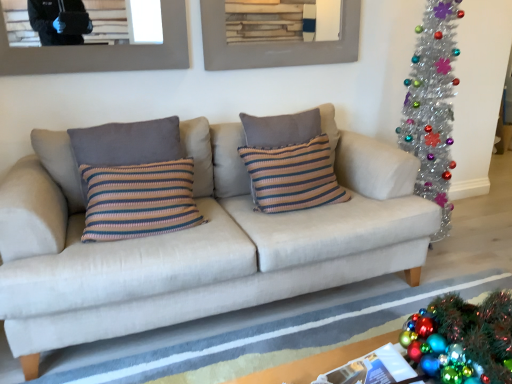
Image resolution: width=512 pixels, height=384 pixels. Describe the element at coordinates (276, 43) in the screenshot. I see `wooden frame at upper center, marked as the first picture frame in a right-to-left arrangement` at that location.

Identify the location of striped knit pillow at center, acting as the 2th pillow starting from the left. (292, 176).

This screenshot has height=384, width=512. I want to click on white fabric rug at lower center, so coord(257,330).

What do you see at coordinates (196, 241) in the screenshot? This screenshot has height=384, width=512. I see `beige fabric couch at center` at bounding box center [196, 241].

Locate an element on the screen. shiny metallic wreath at lower right is located at coordinates (462, 339).

Is white fabric rug at lower center with shiny metallic wreath at lower right?

white fabric rug at lower center and shiny metallic wreath at lower right are not in contact.

Is white fabric rug at lower center positioned beyond the bounds of shiny metallic wreath at lower right?

Indeed, white fabric rug at lower center is completely outside shiny metallic wreath at lower right.

What's the angular difference between white fabric rug at lower center and shiny metallic wreath at lower right's facing directions?

93 degrees.

There is a white fabric rug at lower center. Find the location of `christmas decoration above it (from a real-world perspective)`. christmas decoration above it (from a real-world perspective) is located at coordinates (462, 339).

Is point (314, 60) less distant than point (127, 146)?

No.

In terms of width, does wooden frame at upper center, marked as the first picture frame in a right-to-left arrangement, look wider or thinner when compared to striped fabric pillow at left, the 2th pillow positioned from the right?

Clearly, wooden frame at upper center, marked as the first picture frame in a right-to-left arrangement, has less width compared to striped fabric pillow at left, the 2th pillow positioned from the right.

Which object is closer to the camera taking this photo, wooden frame at upper center, marked as the first picture frame in a right-to-left arrangement, or striped fabric pillow at left, the 2th pillow positioned from the right?

striped fabric pillow at left, the 2th pillow positioned from the right, is more forward.

Is wooden frame at upper center, the second picture frame from the left, at the left side of striped fabric pillow at left, marked as the 1th pillow in a left-to-right arrangement?

Incorrect, wooden frame at upper center, the second picture frame from the left, is not on the left side of striped fabric pillow at left, marked as the 1th pillow in a left-to-right arrangement.

From the image's perspective, is shiny metallic wreath at lower right on striped knit pillow at center, acting as the first pillow starting from the right?

No.

Which object is more forward, shiny metallic wreath at lower right or striped knit pillow at center, acting as the first pillow starting from the right?

shiny metallic wreath at lower right.

In the image, is shiny metallic wreath at lower right on the left side or the right side of striped knit pillow at center, acting as the first pillow starting from the right?

Based on their positions, shiny metallic wreath at lower right is located to the right of striped knit pillow at center, acting as the first pillow starting from the right.

Between striped fabric pillow at left, marked as the 1th pillow in a left-to-right arrangement, and brushed metal picture frame at upper center, the first picture frame from the left, which one appears on the left side from the viewer's perspective?

From the viewer's perspective, brushed metal picture frame at upper center, the first picture frame from the left, appears more on the left side.

From a real-world perspective, is striped fabric pillow at left, marked as the 1th pillow in a left-to-right arrangement, positioned above or below brushed metal picture frame at upper center, the first picture frame from the left?

striped fabric pillow at left, marked as the 1th pillow in a left-to-right arrangement, is below brushed metal picture frame at upper center, the first picture frame from the left.

Looking at this image, is there a large distance between striped fabric pillow at left, marked as the 1th pillow in a left-to-right arrangement, and brushed metal picture frame at upper center, the second picture frame from the right?

striped fabric pillow at left, marked as the 1th pillow in a left-to-right arrangement, is near brushed metal picture frame at upper center, the second picture frame from the right, not far away.

From the image's perspective, is striped fabric pillow at left, marked as the 1th pillow in a left-to-right arrangement, above or below brushed metal picture frame at upper center, the second picture frame from the right?

Based on their image positions, striped fabric pillow at left, marked as the 1th pillow in a left-to-right arrangement, is located beneath brushed metal picture frame at upper center, the second picture frame from the right.

What are the coordinates of `the 2nd pillow to the right when counting from the brushed metal picture frame at upper center, the first picture frame from the left` in the screenshot? It's located at (292, 176).

Between point (293, 149) and point (42, 59), which one is positioned behind?

Point (293, 149)

Is the position of white fabric rug at lower center more distant than that of brushed metal picture frame at upper center, the second picture frame from the right?

No.

Considering the sizes of objects white fabric rug at lower center and brushed metal picture frame at upper center, the first picture frame from the left, in the image provided, who is wider, white fabric rug at lower center or brushed metal picture frame at upper center, the first picture frame from the left,?

Wider between the two is white fabric rug at lower center.

Considering the points (121, 381) and (9, 74), which point is behind, point (121, 381) or point (9, 74)?

The point (9, 74) is behind.

From a real-world perspective, which object rests below the other?

white fabric rug at lower center is physically lower.

Could you tell me if shiny metallic wreath at lower right is facing wooden frame at upper center, marked as the first picture frame in a right-to-left arrangement?

No, shiny metallic wreath at lower right is not oriented towards wooden frame at upper center, marked as the first picture frame in a right-to-left arrangement.

Considering the relative sizes of shiny metallic wreath at lower right and wooden frame at upper center, marked as the first picture frame in a right-to-left arrangement, in the image provided, is shiny metallic wreath at lower right wider than wooden frame at upper center, marked as the first picture frame in a right-to-left arrangement,?

Yes.

How much distance is there between shiny metallic wreath at lower right and wooden frame at upper center, the second picture frame from the left?

shiny metallic wreath at lower right is 1.69 meters from wooden frame at upper center, the second picture frame from the left.

Considering the relative sizes of shiny metallic wreath at lower right and wooden frame at upper center, marked as the first picture frame in a right-to-left arrangement, in the image provided, is shiny metallic wreath at lower right smaller than wooden frame at upper center, marked as the first picture frame in a right-to-left arrangement,?

Incorrect, shiny metallic wreath at lower right is not smaller in size than wooden frame at upper center, marked as the first picture frame in a right-to-left arrangement.

The image size is (512, 384). What are the coordinates of `strip below the shiny metallic wreath at lower right (from the image's perspective)` in the screenshot? It's located at (257, 330).

Where is `the 2nd picture frame located above the striped fabric pillow at left, marked as the 1th pillow in a left-to-right arrangement (from a real-world perspective)`? the 2nd picture frame located above the striped fabric pillow at left, marked as the 1th pillow in a left-to-right arrangement (from a real-world perspective) is located at coordinates (276, 43).

When comparing their distances from beige fabric couch at center, does white fabric rug at lower center or striped knit pillow at center, acting as the first pillow starting from the right, seem closer?

striped knit pillow at center, acting as the first pillow starting from the right, is closer to beige fabric couch at center.

Based on their spatial positions, is shiny metallic wreath at lower right or striped knit pillow at center, acting as the 2th pillow starting from the left, closer to striped fabric pillow at left, marked as the 1th pillow in a left-to-right arrangement?

The object closer to striped fabric pillow at left, marked as the 1th pillow in a left-to-right arrangement, is striped knit pillow at center, acting as the 2th pillow starting from the left.

Estimate the real-world distances between objects in this image. Which object is further from wooden frame at upper center, the second picture frame from the left, brushed metal picture frame at upper center, the first picture frame from the left, or shiny metallic wreath at lower right?

shiny metallic wreath at lower right is positioned further to the anchor wooden frame at upper center, the second picture frame from the left.

Looking at the image, which one is located further to shiny metallic wreath at lower right, striped fabric pillow at left, marked as the 1th pillow in a left-to-right arrangement, or white fabric rug at lower center?

striped fabric pillow at left, marked as the 1th pillow in a left-to-right arrangement.

From the image, which object appears to be farther from wooden frame at upper center, marked as the first picture frame in a right-to-left arrangement, brushed metal picture frame at upper center, the first picture frame from the left, or striped fabric pillow at left, marked as the 1th pillow in a left-to-right arrangement?

striped fabric pillow at left, marked as the 1th pillow in a left-to-right arrangement.

Looking at the image, which one is located closer to striped knit pillow at center, acting as the 2th pillow starting from the left, shiny metallic wreath at lower right or brushed metal picture frame at upper center, the second picture frame from the right?

brushed metal picture frame at upper center, the second picture frame from the right, lies closer to striped knit pillow at center, acting as the 2th pillow starting from the left, than the other object.

When comparing their distances from striped fabric pillow at left, the 2th pillow positioned from the right, does wooden frame at upper center, the second picture frame from the left, or brushed metal picture frame at upper center, the first picture frame from the left, seem closer?

The object closer to striped fabric pillow at left, the 2th pillow positioned from the right, is brushed metal picture frame at upper center, the first picture frame from the left.

Which object lies nearer to the anchor point shiny metallic wreath at lower right, beige fabric couch at center or striped fabric pillow at left, marked as the 1th pillow in a left-to-right arrangement?

Among the two, beige fabric couch at center is located nearer to shiny metallic wreath at lower right.

This screenshot has width=512, height=384. I want to click on pillow between beige fabric couch at center and striped knit pillow at center, acting as the 2th pillow starting from the left, in the front-back direction, so click(x=127, y=143).

Locate an element on the screen. The image size is (512, 384). pillow between striped fabric pillow at left, marked as the 1th pillow in a left-to-right arrangement, and white fabric rug at lower center is located at coordinates (292, 176).

This screenshot has width=512, height=384. In order to click on pillow located between brushed metal picture frame at upper center, the second picture frame from the right, and wooden frame at upper center, marked as the first picture frame in a right-to-left arrangement, in the left-right direction in this screenshot , I will do `click(127, 143)`.

Find the location of a particular element. christmas decoration between brushed metal picture frame at upper center, the first picture frame from the left, and white fabric rug at lower center in the up-down direction is located at coordinates (462, 339).